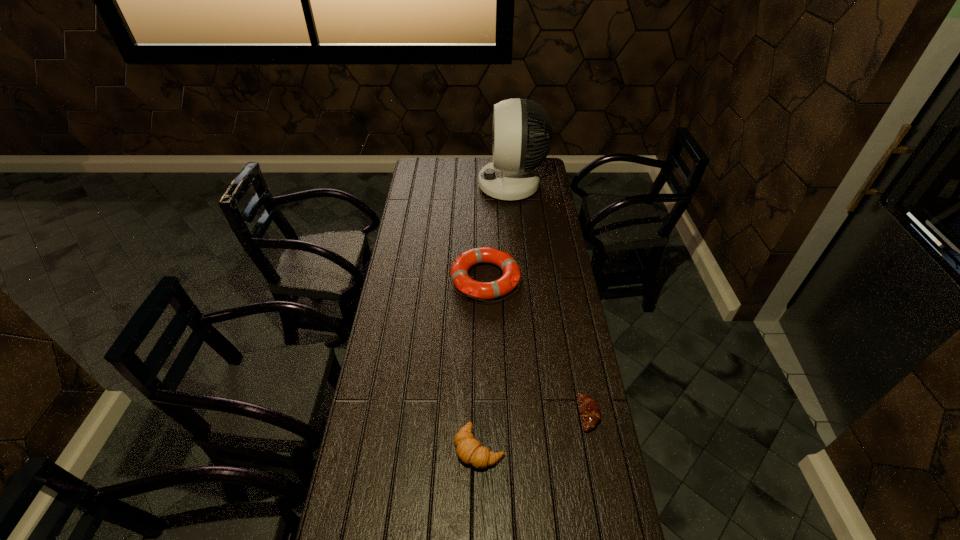
The width and height of the screenshot is (960, 540). In the image, there is a desktop. Identify the location of free space at the right edge. (554, 433).

Identify the location of vacant area between the second farthest object and the shortest object. (537, 346).

Where is `free space between the left crescent roll and the tallest object`? The width and height of the screenshot is (960, 540). free space between the left crescent roll and the tallest object is located at coordinates (495, 316).

Where is `free space that is in between the third tallest object and the shorter crescent roll`? Image resolution: width=960 pixels, height=540 pixels. free space that is in between the third tallest object and the shorter crescent roll is located at coordinates (534, 431).

Where is `vacant area between the second tallest object and the left crescent roll`? Image resolution: width=960 pixels, height=540 pixels. vacant area between the second tallest object and the left crescent roll is located at coordinates (482, 363).

Identify the location of free space between the right crescent roll and the third tallest object. This screenshot has width=960, height=540. (534, 431).

Where is `unoccupied area between the third shortest object and the right crescent roll`? unoccupied area between the third shortest object and the right crescent roll is located at coordinates (537, 346).

Locate an element on the screen. Image resolution: width=960 pixels, height=540 pixels. object that ranks as the third closest to the second shortest object is located at coordinates (511, 176).

In order to click on object that ranks as the second closest to the tallest object in this screenshot , I will do `click(589, 409)`.

Image resolution: width=960 pixels, height=540 pixels. I want to click on crescent roll that can be found as the closest to the second farthest object, so click(x=589, y=409).